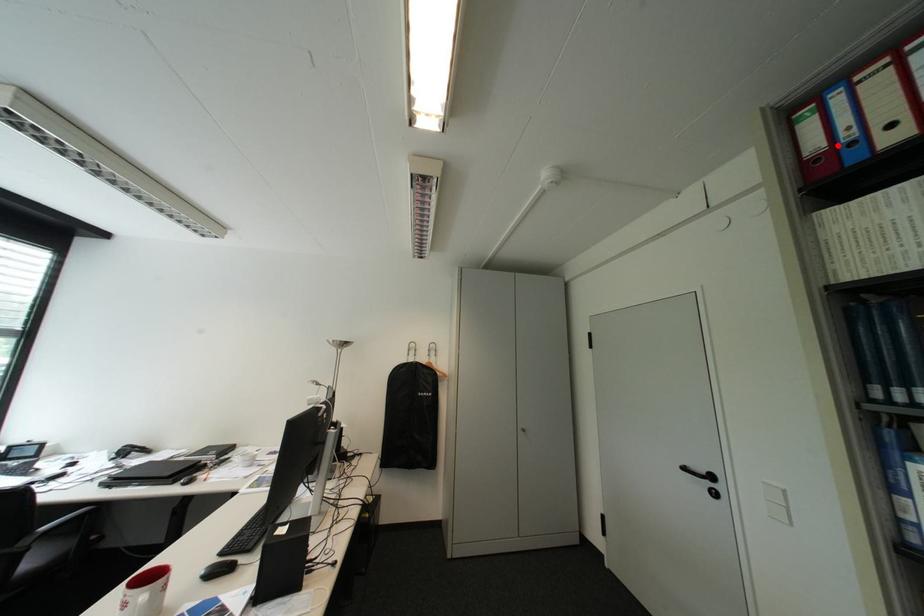
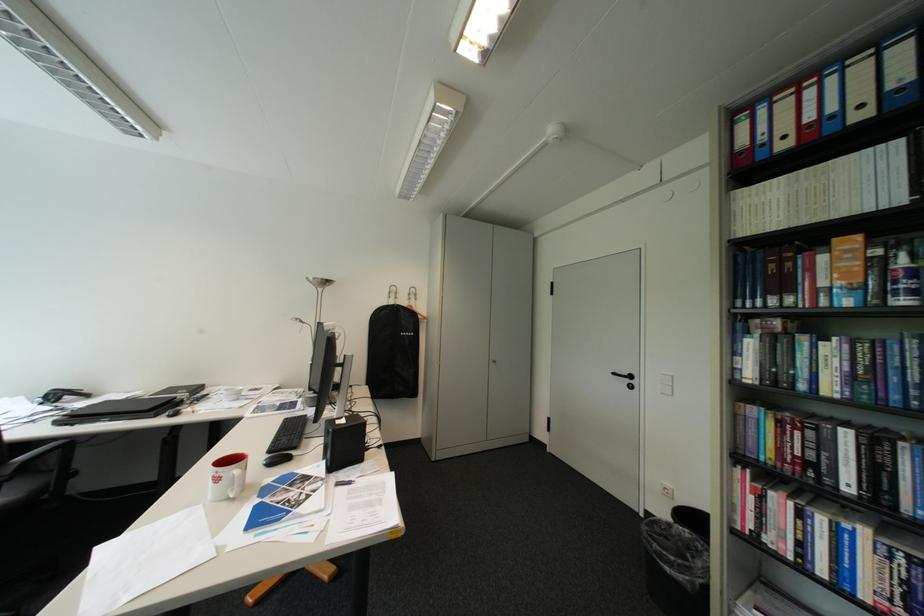
Locate, in the second image, the point that corresponds to the highlighted location in the first image.

(760, 145)